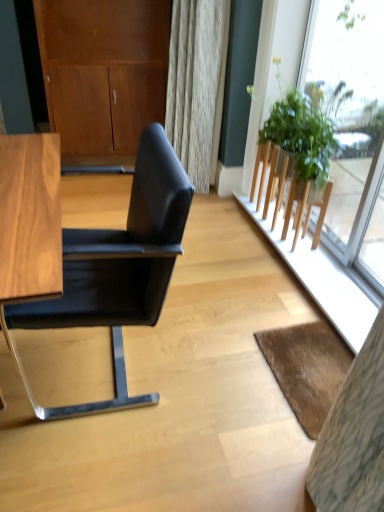
The image size is (384, 512). Find the location of `free space above brown textured mat at lower right (from a real-world perspective)`. free space above brown textured mat at lower right (from a real-world perspective) is located at coordinates (307, 362).